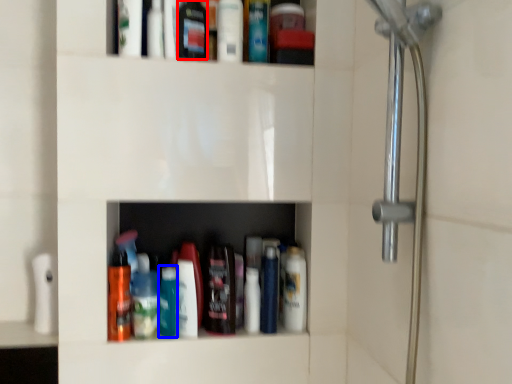
Question: Which of the following is the farthest to the observer, mouthwash (highlighted by a red box) or bottle (highlighted by a blue box)?

Choices:
 (A) mouthwash
 (B) bottle

Answer: (B)